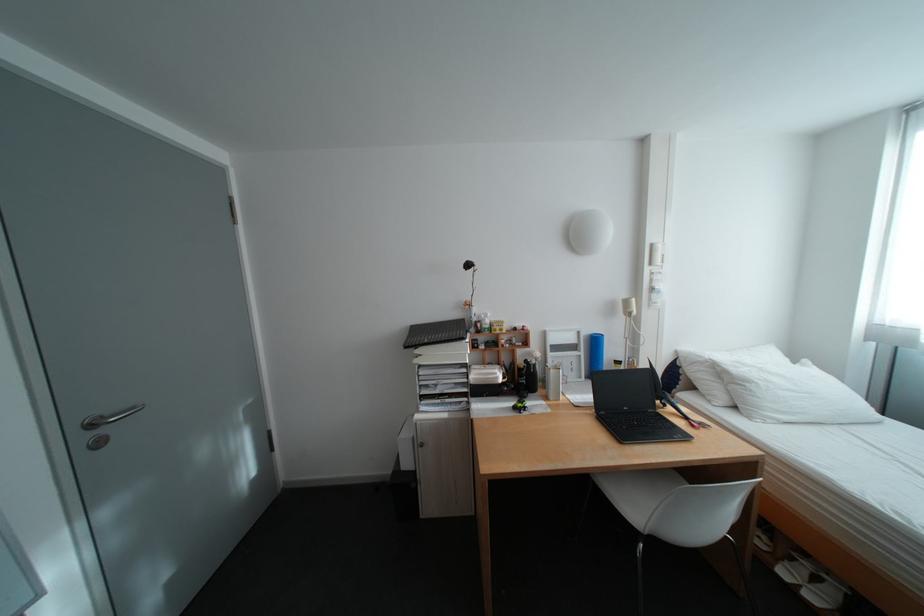
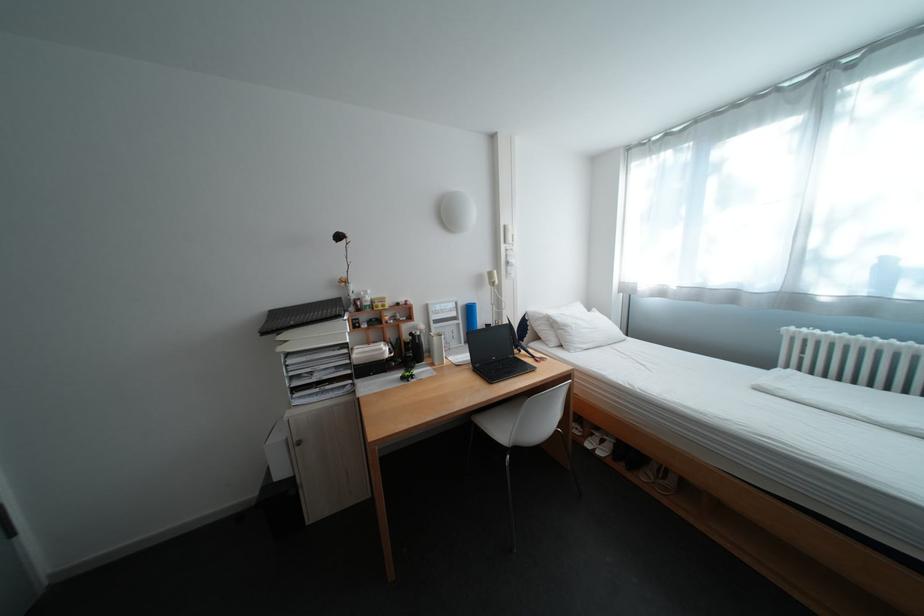
Which direction would the cameraman need to move to produce the second image?

The cameraman walked toward right, backward.